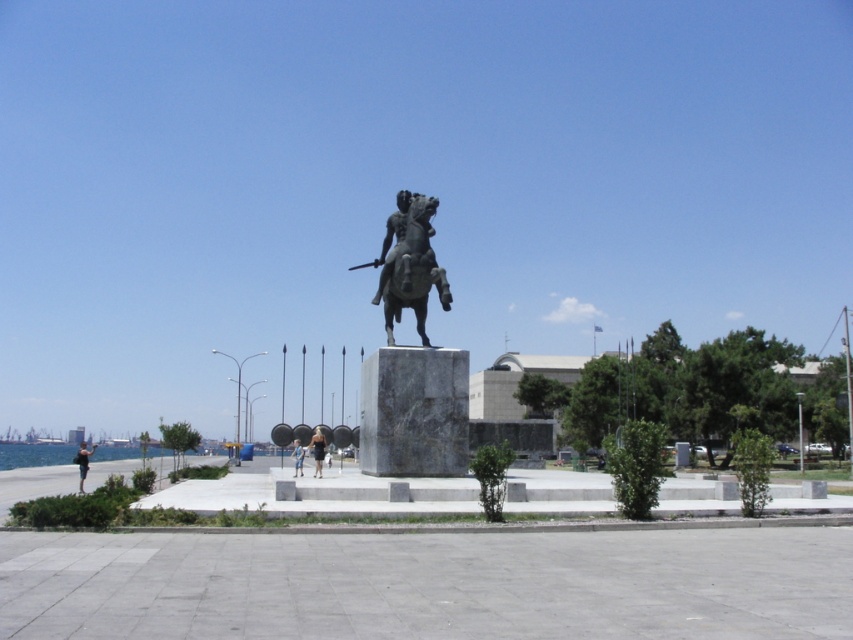
Is bronze statue at center above blue denim shorts at center?

Indeed, bronze statue at center is positioned over blue denim shorts at center.

This screenshot has width=853, height=640. Describe the element at coordinates (409, 262) in the screenshot. I see `bronze statue at center` at that location.

The width and height of the screenshot is (853, 640). What are the coordinates of `bronze statue at center` in the screenshot? It's located at (409, 262).

From the picture: Can you confirm if light blue denim shorts at lower left is positioned to the right of blue denim shorts at center?

Incorrect, light blue denim shorts at lower left is not on the right side of blue denim shorts at center.

Where is `light blue denim shorts at lower left`? light blue denim shorts at lower left is located at coordinates (83, 461).

Is point (84, 444) more distant than point (294, 458)?

Yes.

Where is `light blue denim shorts at lower left`? This screenshot has width=853, height=640. light blue denim shorts at lower left is located at coordinates (83, 461).

Does dark blue dress at center come behind blue denim shorts at center?

No, dark blue dress at center is closer to the viewer.

In order to click on dark blue dress at center in this screenshot , I will do `click(317, 451)`.